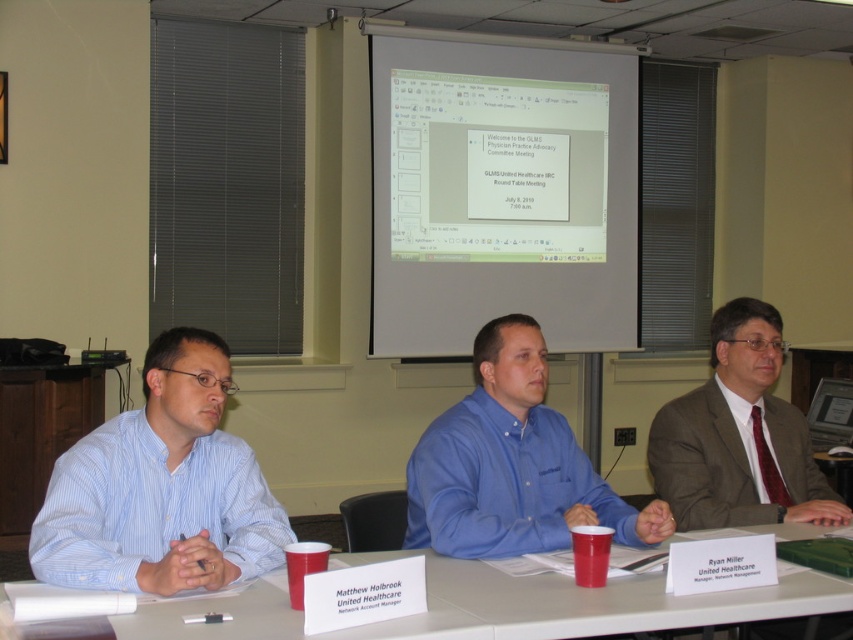
Question: Is blue striped shirt at left to the left of matte brown suit at right from the viewer's perspective?

Choices:
 (A) no
 (B) yes

Answer: (B)

Question: Based on their relative distances, which object is nearer to the white paper at center?

Choices:
 (A) matte brown suit at right
 (B) blue button-down shirt at center
 (C) blue striped shirt at left
 (D) white matte projector screen at upper center

Answer: (B)

Question: Can you confirm if white matte projector screen at upper center is positioned above blue striped shirt at left?

Choices:
 (A) no
 (B) yes

Answer: (B)

Question: Estimate the real-world distances between objects in this image. Which object is closer to the matte brown suit at right?

Choices:
 (A) blue striped shirt at left
 (B) white paper at center

Answer: (B)

Question: Which point is farther from the camera taking this photo?

Choices:
 (A) (610, 616)
 (B) (120, 445)
 (C) (519, 104)

Answer: (C)

Question: Is blue button-down shirt at center positioned behind white paper at center?

Choices:
 (A) no
 (B) yes

Answer: (B)